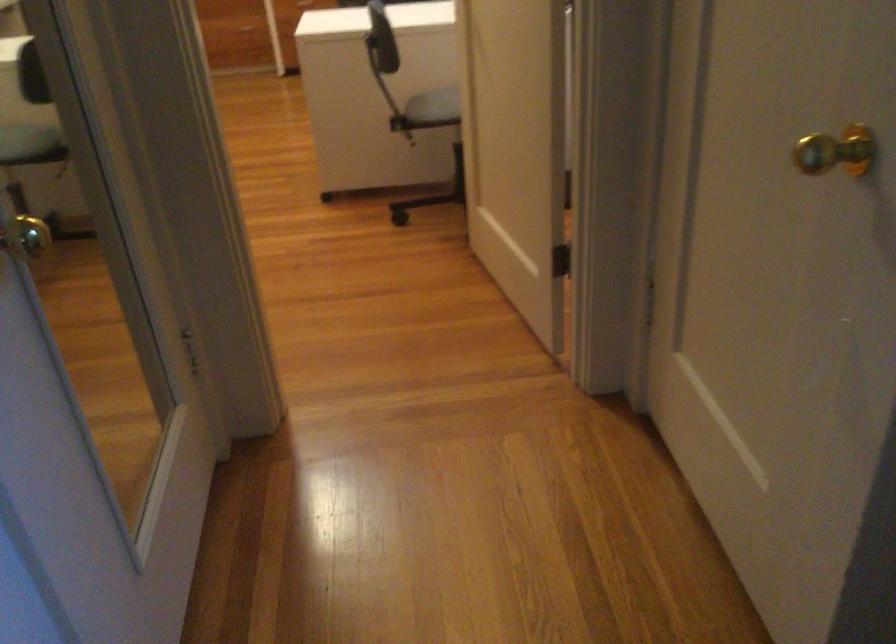
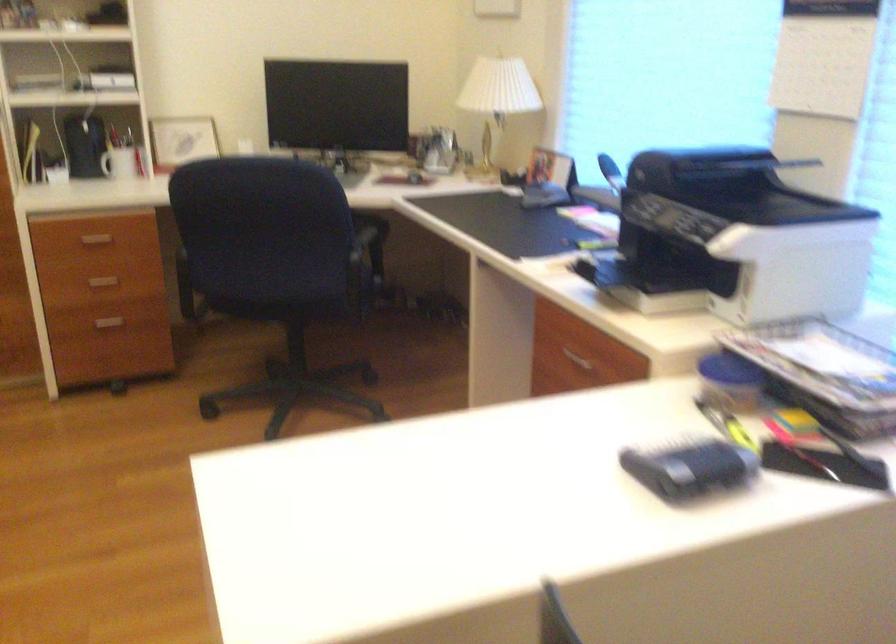
Question: Which direction would the cameraman need to move to produce the second image? Reply with the corresponding letter.

Choices:
 (A) Left
 (B) Right
 (C) Forward
 (D) Backward

Answer: (C)